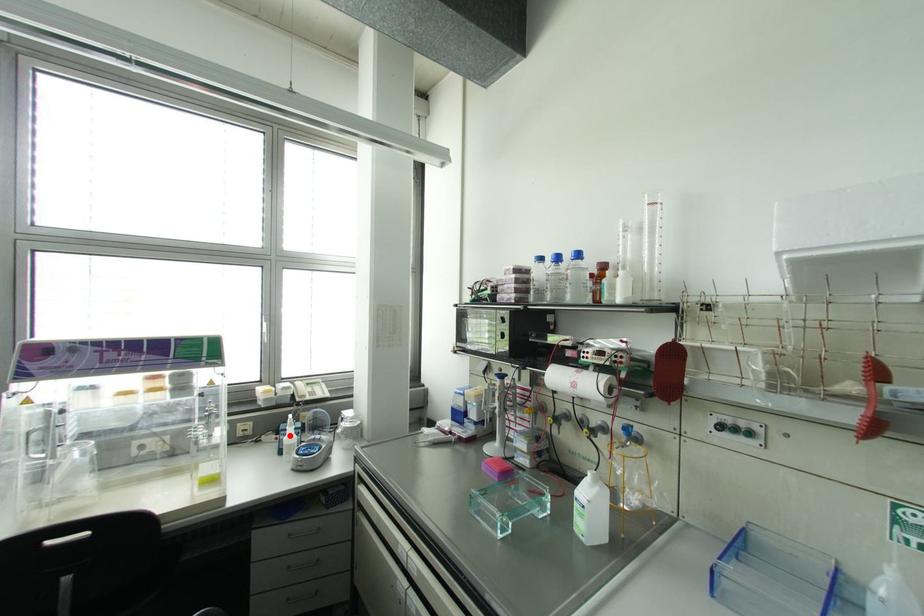
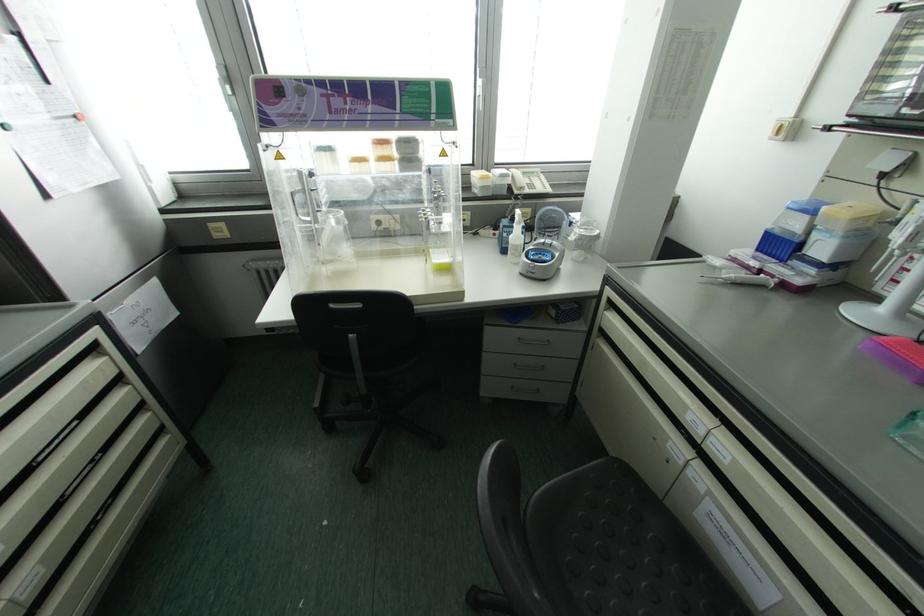
In the second image, find the point that corresponds to the highlighted location in the first image.

(516, 235)